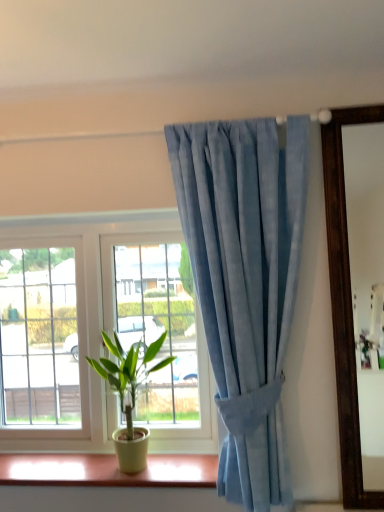
This screenshot has height=512, width=384. Identify the location of free space above matte yellow plastic at lower center (from a real-world perspective). (92, 464).